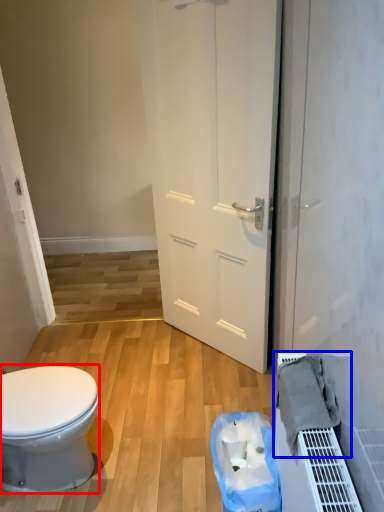
Question: Which point is further to the camera, bidet (highlighted by a red box) or material (highlighted by a blue box)?

Choices:
 (A) bidet
 (B) material

Answer: (A)